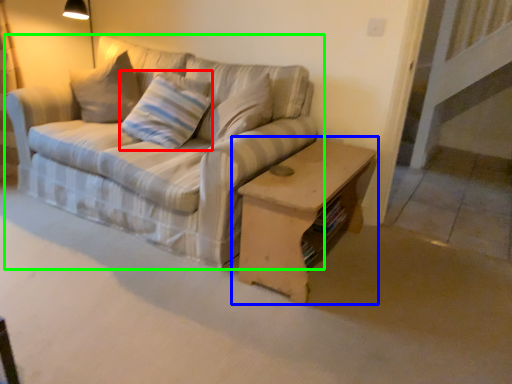
Question: Which object is the farthest from pillow (highlighted by a red box)? Choose among these: table (highlighted by a blue box) or studio couch (highlighted by a green box).

Choices:
 (A) table
 (B) studio couch

Answer: (A)